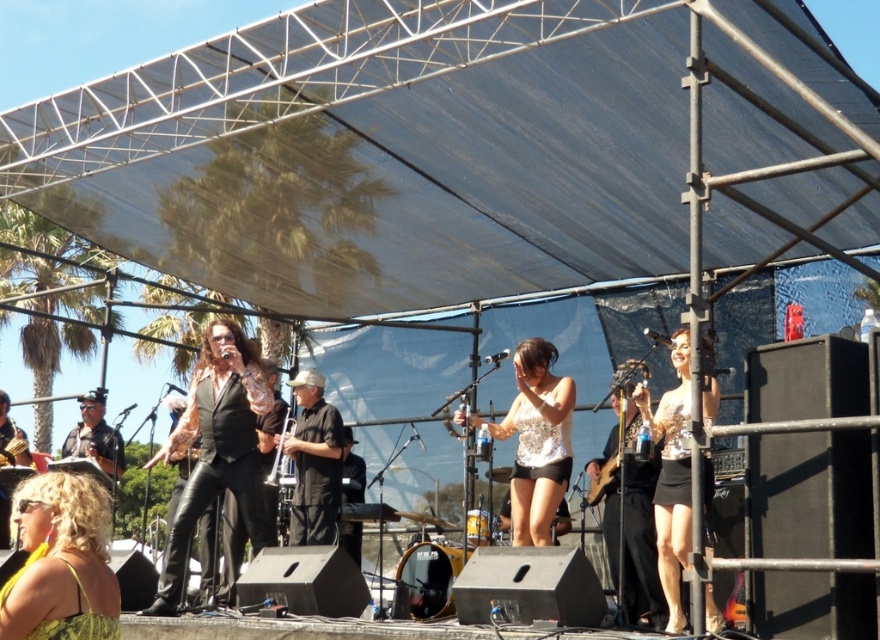
You are standing at the front of the stage and want to move towards the point labeled point (683, 540). Is this point closer to you than the other point labeled point (305, 518)?

Yes, the point (683, 540) is closer to the viewer than point (305, 518) according to the description.